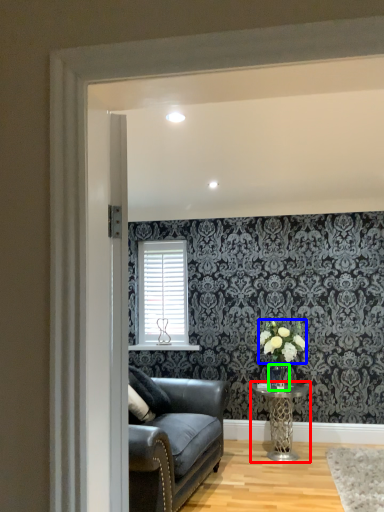
Question: Which is nearer to the table (highlighted by a red box)? flower (highlighted by a blue box) or glass vase (highlighted by a green box).

Choices:
 (A) flower
 (B) glass vase

Answer: (B)